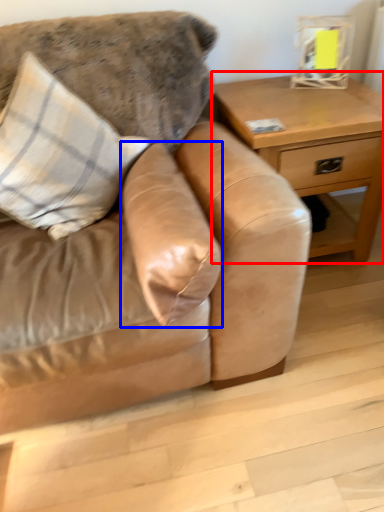
Question: Among these objects, which one is nearest to the camera, table (highlighted by a red box) or pillow (highlighted by a blue box)?

Choices:
 (A) table
 (B) pillow

Answer: (B)